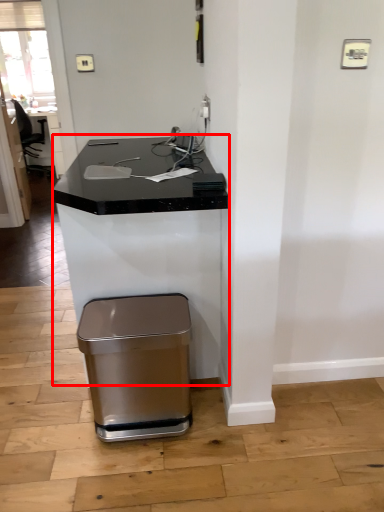
Question: Where is computer desk (annotated by the red box) located in relation to waste container in the image?

Choices:
 (A) right
 (B) left

Answer: (B)